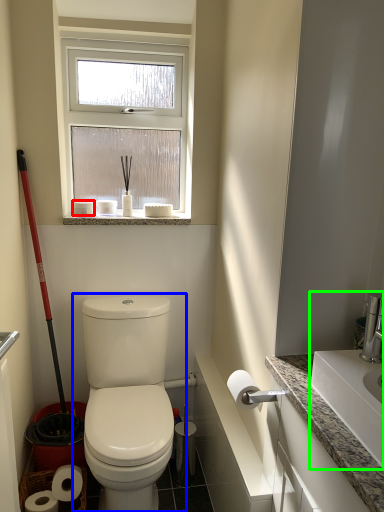
Question: Which object is the closest to the toilet paper (highlighted by a red box)? Choose among these: toilet (highlighted by a blue box) or sink (highlighted by a green box).

Choices:
 (A) toilet
 (B) sink

Answer: (A)